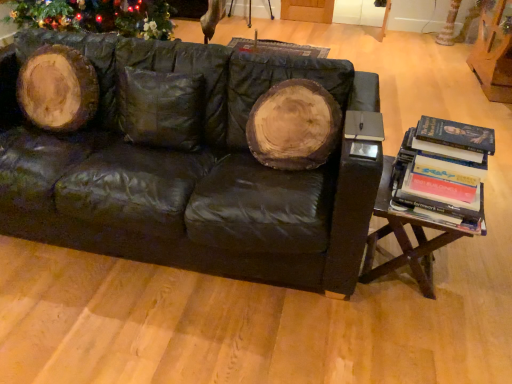
Question: Considering the positions of point (367, 127) and point (407, 241), is point (367, 127) closer or farther from the camera than point (407, 241)?

Choices:
 (A) closer
 (B) farther

Answer: (A)

Question: Relative to woodenmaterial/texturetable at right, is matte black book at right in front or behind?

Choices:
 (A) front
 (B) behind

Answer: (B)

Question: Estimate the real-world distances between objects in this image. Which object is closer to the woodenmaterial/texturetable at right?

Choices:
 (A) hardcover books at right
 (B) black leather couch at center
 (C) matte black book at right
 (D) white textured tree trunk at upper right

Answer: (A)

Question: Considering the real-world distances, which object is closest to the woodenmaterial/texturetable at right?

Choices:
 (A) matte black book at right
 (B) white textured tree trunk at upper right
 (C) black leather couch at center
 (D) hardcover books at right

Answer: (D)